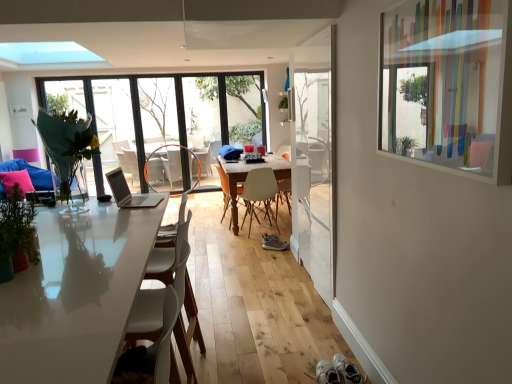
Question: Does point (110, 130) appear closer or farther from the camera than point (1, 241)?

Choices:
 (A) closer
 (B) farther

Answer: (B)

Question: From a real-world perspective, is matte glass door at center positioned above or below green matte plant at left, the 2th plant from the back?

Choices:
 (A) above
 (B) below

Answer: (A)

Question: Considering the real-world distances, which object is closest to the beige plastic chair at center, the 2th chair positioned from the front?

Choices:
 (A) matte orange armchair at center
 (B) translucent plastic window screen at upper right
 (C) transparent glass window at upper center
 (D) matte glass door at center
 (E) green matte plant at center, the second plant in the front-to-back sequence

Answer: (E)

Question: Which of these objects is positioned farthest from the transparent glass window at upper center?

Choices:
 (A) wooden round table at center
 (B) white plastic chair at center, positioned as the first chair in front-to-back order
 (C) matte orange armchair at center
 (D) translucent plastic window screen at upper right
 (E) green matte plant at center, the second plant in the front-to-back sequence

Answer: (D)